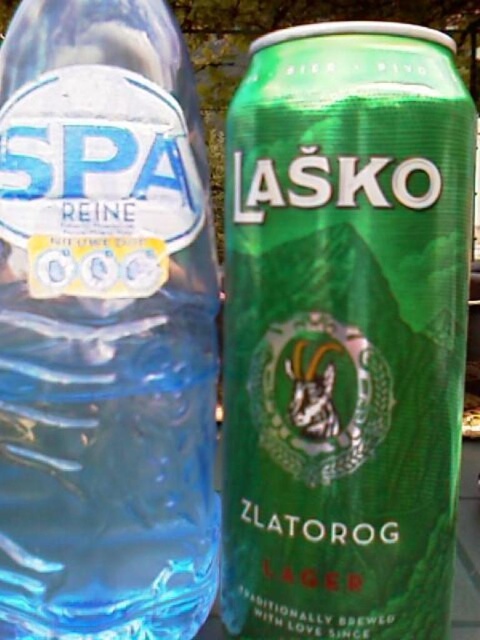
Question: Can you confirm if green matte can at right is positioned to the left of transparent plastic bottle at left?

Choices:
 (A) no
 (B) yes

Answer: (A)

Question: Which point is farther to the camera?

Choices:
 (A) green matte can at right
 (B) transparent plastic bottle at left

Answer: (B)

Question: Can you confirm if green matte can at right is positioned to the left of transparent plastic bottle at left?

Choices:
 (A) no
 (B) yes

Answer: (A)

Question: Is green matte can at right wider than transparent plastic bottle at left?

Choices:
 (A) no
 (B) yes

Answer: (B)